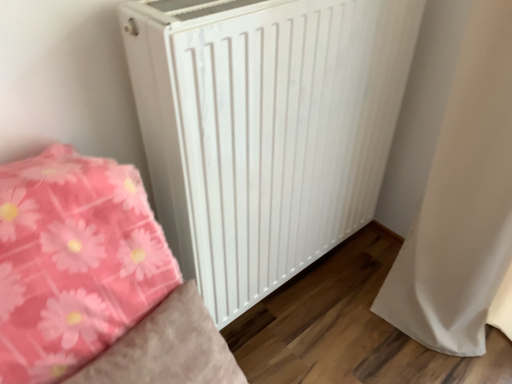
The height and width of the screenshot is (384, 512). What do you see at coordinates (265, 129) in the screenshot? I see `white matte radiator at center` at bounding box center [265, 129].

Locate an element on the screen. Image resolution: width=512 pixels, height=384 pixels. white matte radiator at center is located at coordinates (265, 129).

Locate an element on the screen. Image resolution: width=512 pixels, height=384 pixels. white fabric curtain at right is located at coordinates (461, 190).

The height and width of the screenshot is (384, 512). What do you see at coordinates (461, 190) in the screenshot? I see `white fabric curtain at right` at bounding box center [461, 190].

Locate an element on the screen. white matte radiator at center is located at coordinates (265, 129).

Considering the relative positions of white fabric curtain at right and white matte radiator at center in the image provided, is white fabric curtain at right to the left or to the right of white matte radiator at center?

white fabric curtain at right is to the right of white matte radiator at center.

Between white fabric curtain at right and white matte radiator at center, which one is positioned in front?

white matte radiator at center is closer to the camera.

Does point (450, 173) appear closer or farther from the camera than point (354, 176)?

Point (450, 173) is positioned closer to the camera compared to point (354, 176).

From the image's perspective, is white fabric curtain at right over white matte radiator at center?

No, from the image's perspective, white fabric curtain at right is not on top of white matte radiator at center.

From a real-world perspective, is white fabric curtain at right positioned above or below white matte radiator at center?

white fabric curtain at right is below white matte radiator at center.

Is white fabric curtain at right thinner than white matte radiator at center?

In fact, white fabric curtain at right might be wider than white matte radiator at center.

Can you confirm if white fabric curtain at right is taller than white matte radiator at center?

Yes, white fabric curtain at right is taller than white matte radiator at center.

Which of these two, white fabric curtain at right or white matte radiator at center, is bigger?

white matte radiator at center.

Would you say white fabric curtain at right is inside or outside white matte radiator at center?

white fabric curtain at right exists outside the volume of white matte radiator at center.

Can you see white fabric curtain at right touching white matte radiator at center?

There is a gap between white fabric curtain at right and white matte radiator at center.

Is white fabric curtain at right facing towards white matte radiator at center?

No, white fabric curtain at right does not turn towards white matte radiator at center.

Locate an element on the screen. The image size is (512, 384). curtain below the white matte radiator at center (from the image's perspective) is located at coordinates (461, 190).

Which object is positioned more to the left, white matte radiator at center or white fabric curtain at right?

white matte radiator at center.

Between white matte radiator at center and white fabric curtain at right, which one is positioned in front?

white matte radiator at center is more forward.

Which is closer to the camera, (381, 45) or (485, 87)?

The point (485, 87) is closer to the camera.

From the image's perspective, relative to white fabric curtain at right, is white matte radiator at center above or below?

Clearly, from the image's perspective, white matte radiator at center is above white fabric curtain at right.

From a real-world perspective, which object stands above the other?

In real-world perspective, white matte radiator at center is above.

Which of these two, white matte radiator at center or white fabric curtain at right, is thinner?

white matte radiator at center.

Based on the photo, between white matte radiator at center and white fabric curtain at right, which one has less height?

With less height is white matte radiator at center.

Can you confirm if white matte radiator at center is bigger than white fabric curtain at right?

Correct, white matte radiator at center is larger in size than white fabric curtain at right.

Would you say white matte radiator at center is outside white fabric curtain at right?

That's correct, white matte radiator at center is outside of white fabric curtain at right.

Is white matte radiator at center next to white fabric curtain at right?

white matte radiator at center and white fabric curtain at right are clearly separated.

Is white matte radiator at center oriented towards white fabric curtain at right?

Yes.

Looking at this image, how many degrees apart are the facing directions of white matte radiator at center and white fabric curtain at right?

89.5 degrees.

In the image, there is a white fabric curtain at right. Where is `radiator above it (from the image's perspective)`? radiator above it (from the image's perspective) is located at coordinates (265, 129).

Locate an element on the screen. The height and width of the screenshot is (384, 512). radiator above the white fabric curtain at right (from a real-world perspective) is located at coordinates (265, 129).

Image resolution: width=512 pixels, height=384 pixels. Identify the location of curtain below the white matte radiator at center (from the image's perspective). (461, 190).